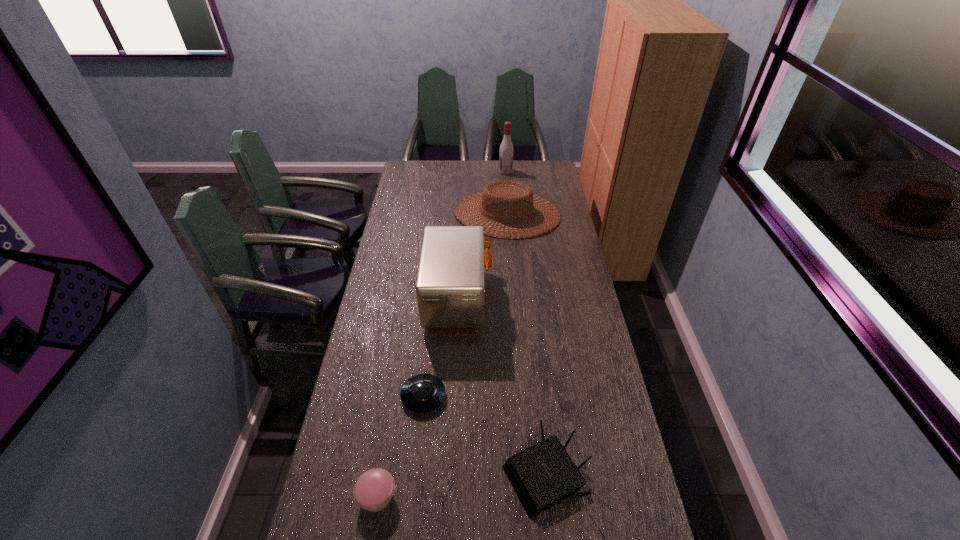
I want to click on free space in the image that satisfies the following two spatial constraints: 1. on the back side of the saucer; 2. on the left side of the second shortest object, so click(394, 396).

Identify the location of free region that satisfies the following two spatial constraints: 1. on the door side of the second tallest object; 2. on the back side of the router. The image size is (960, 540). (450, 474).

Locate an element on the screen. vacant space that satisfies the following two spatial constraints: 1. on the back side of the saucer; 2. on the right side of the cupcake is located at coordinates (394, 396).